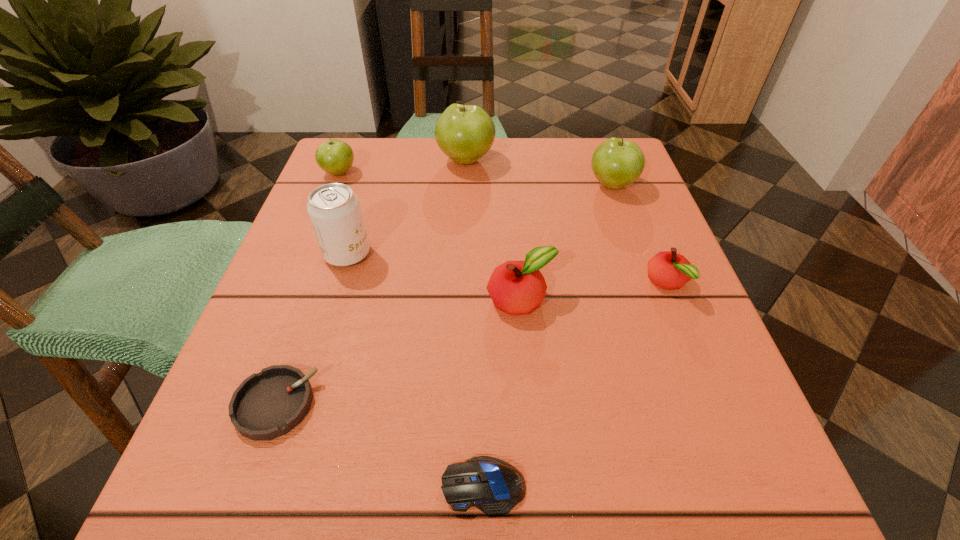
You are a GUI agent. You are given a task and a screenshot of the screen. Output one action in this format:
    pyautogui.click(x=<x>, y=<y>)
    Task: Click on the vacant space at the left edge of the desktop
    The height and width of the screenshot is (540, 960).
    Given the screenshot: What is the action you would take?
    pyautogui.click(x=333, y=374)

Find the location of a particular element. Image resolution: width=960 pixels, height=540 pixels. free spot at the right edge of the desktop is located at coordinates (600, 292).

This screenshot has height=540, width=960. What are the coordinates of `blank space at the far right corner of the desktop` in the screenshot? It's located at (571, 155).

The height and width of the screenshot is (540, 960). Identify the location of free spot between the soda can and the left red apple. (434, 277).

Where is `empty space between the rightmost green apple and the second green apple from left to right`? empty space between the rightmost green apple and the second green apple from left to right is located at coordinates (540, 172).

This screenshot has width=960, height=540. Find the location of `vacant point located between the second nearest object and the third shortest object`. vacant point located between the second nearest object and the third shortest object is located at coordinates (471, 344).

Locate an element on the screen. The width and height of the screenshot is (960, 540). free space that is in between the leftmost apple and the second smallest green apple is located at coordinates (476, 179).

Locate an element on the screen. The width and height of the screenshot is (960, 540). vacant space that's between the left red apple and the ashtray is located at coordinates (398, 352).

This screenshot has width=960, height=540. I want to click on free space between the smaller red apple and the bigger red apple, so click(x=594, y=292).

I want to click on vacant space that's between the ashtray and the soda can, so click(312, 329).